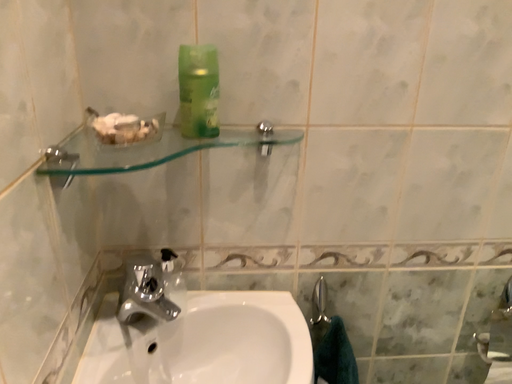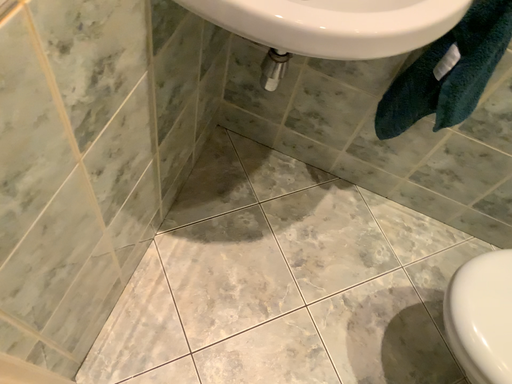
Question: Which way did the camera rotate in the video?

Choices:
 (A) rotated upward
 (B) rotated downward

Answer: (B)